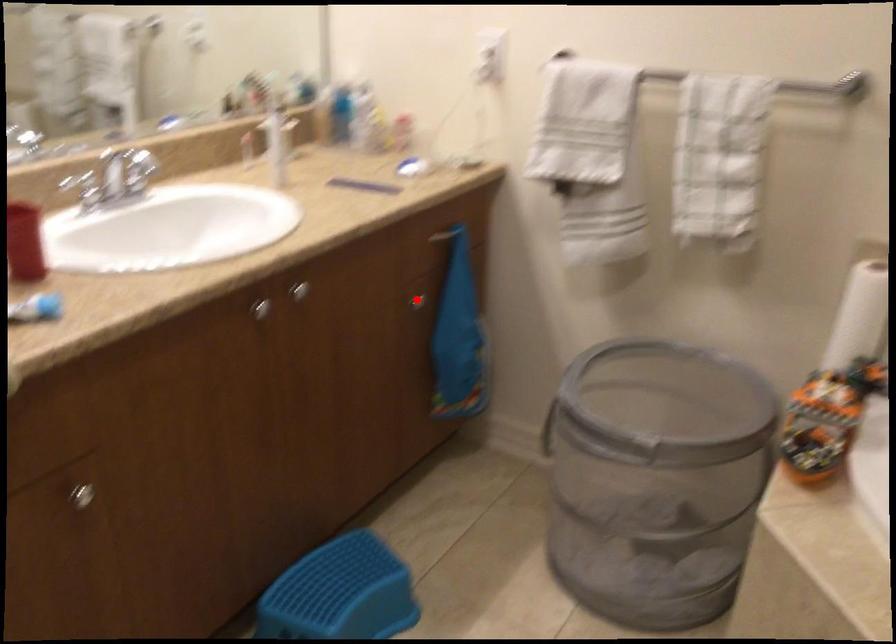
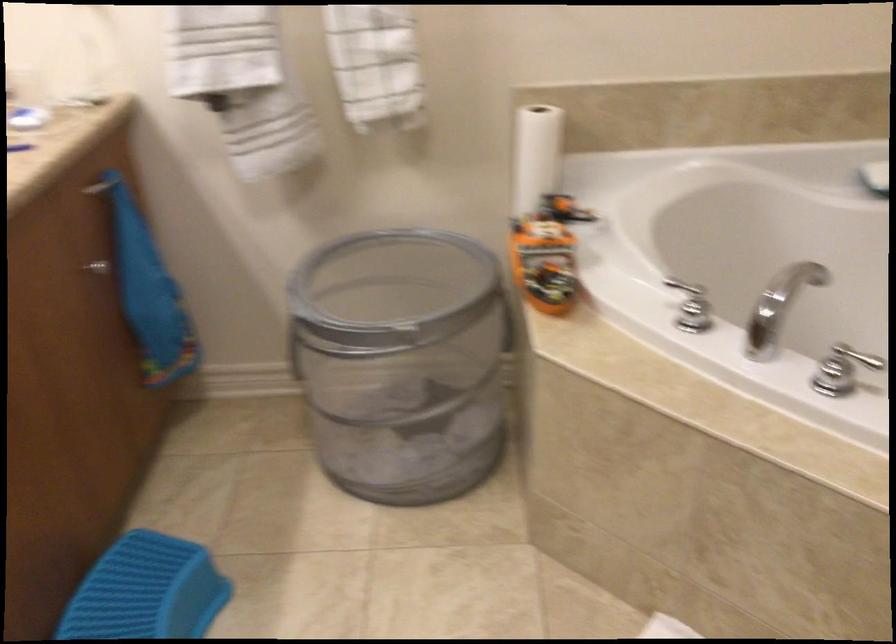
The point at the highlighted location is marked in the first image. Where is the corresponding point in the second image?

(97, 267)